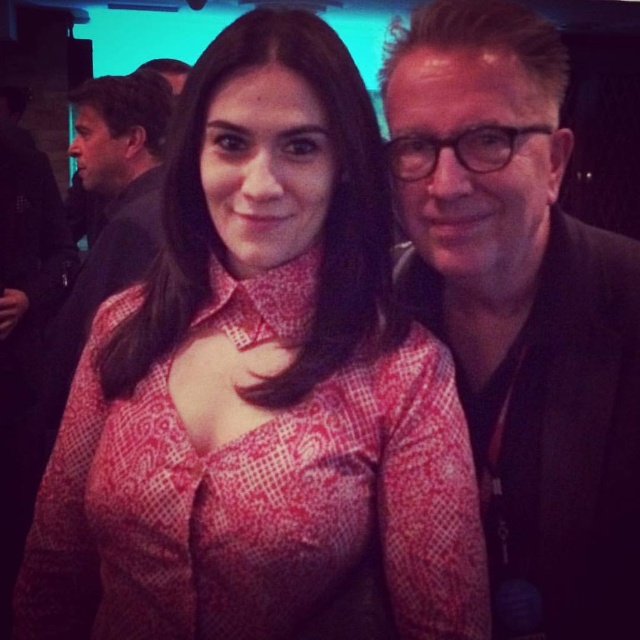
You are a photographer setting up a portrait shoot. You need to ensure that both the pink patterned blouse at center and the matte black suit at center are visible in the frame. Based on their positions, which clothing item is shorter in height?

The pink patterned blouse at center is not as tall as the matte black suit at center, so the pink patterned blouse at center is shorter in height.

Based on the photo, you are standing in front of the photograph and need to determine the exact position of the matte black suit at right. What are its coordinates according to the image grid?

The matte black suit at right is located at point (522, 312).

You are a photographer trying to adjust the lighting for a portrait. You notice the pink patterned blouse at center and the matte black suit at right. Which object should you focus on to ensure proper exposure, considering their positions?

The pink patterned blouse at center should be focused on for proper exposure since it is positioned under the matte black suit at right, which might be in a shadowed area.